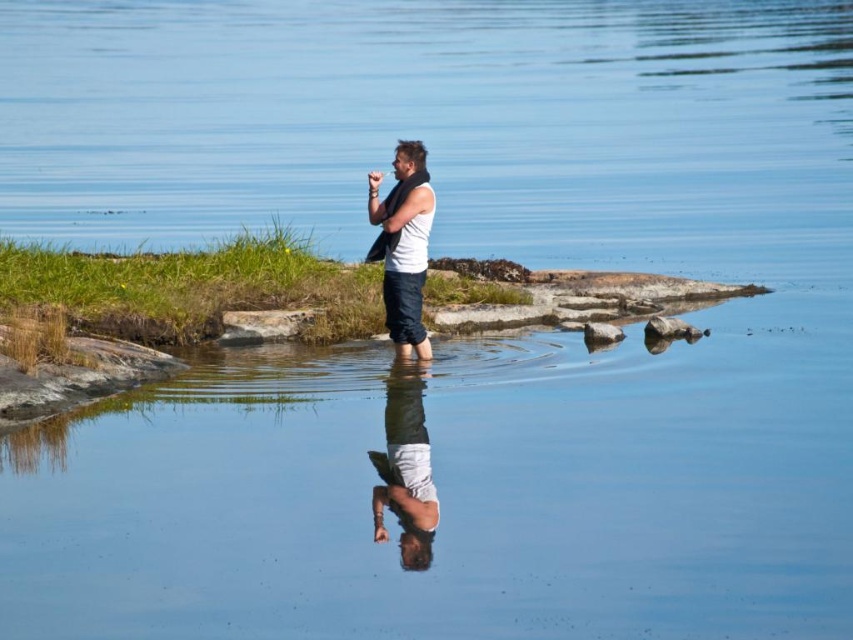
What are the coordinates of the white matte shirt at center?

The white matte shirt at center is located at point (405, 472).